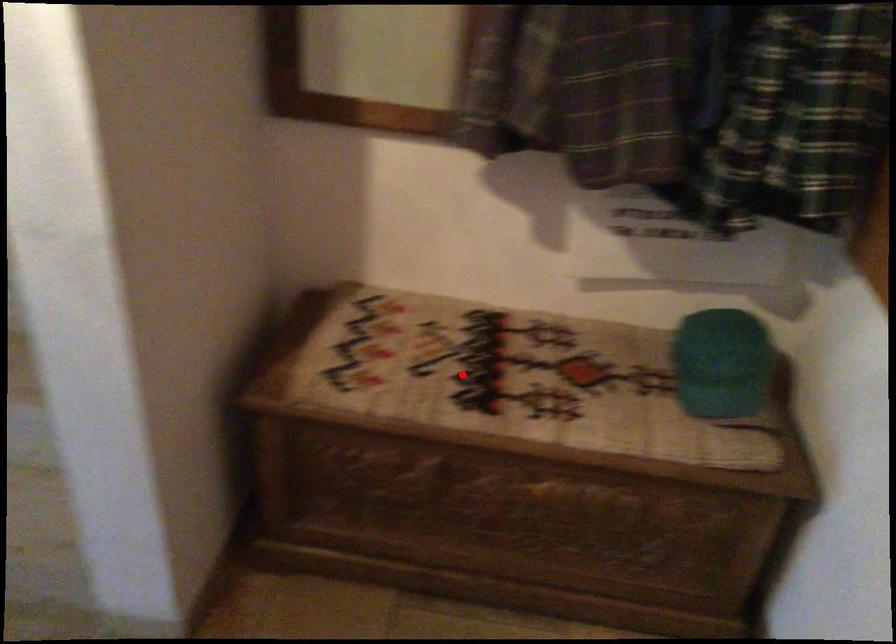
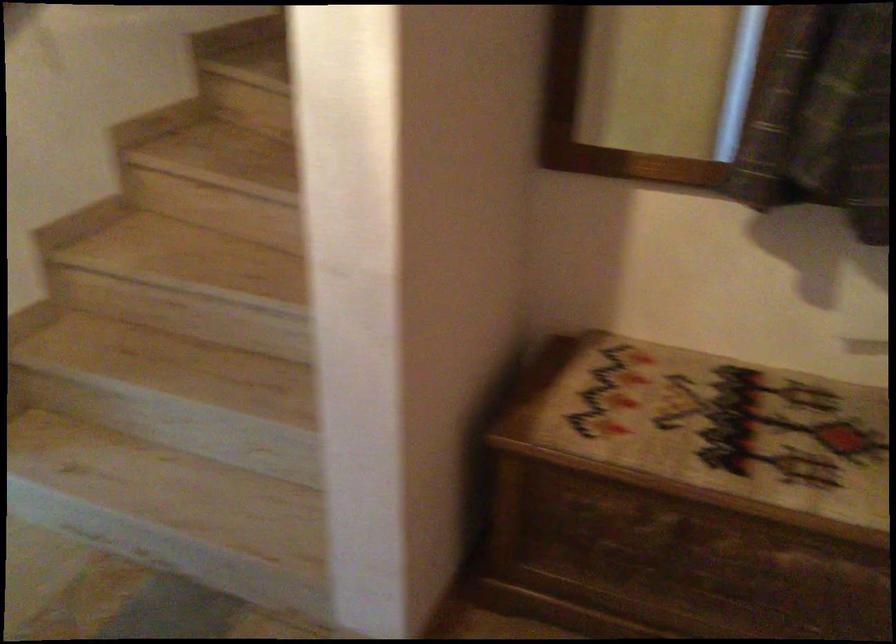
Locate, in the second image, the point that corresponds to the highlighted location in the first image.

(709, 431)